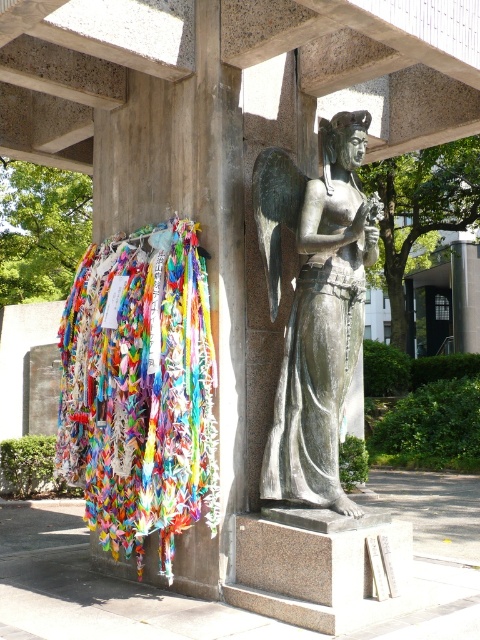
Looking at this image, is multicolored paper cranes at left taller than bronze statue at center?

Incorrect, multicolored paper cranes at left's height is not larger of bronze statue at center's.

What do you see at coordinates (140, 390) in the screenshot? I see `multicolored paper cranes at left` at bounding box center [140, 390].

At what (x,y) coordinates should I click in order to perform the action: click on multicolored paper cranes at left. Please return your answer as a coordinate pair (x, y). Looking at the image, I should click on (140, 390).